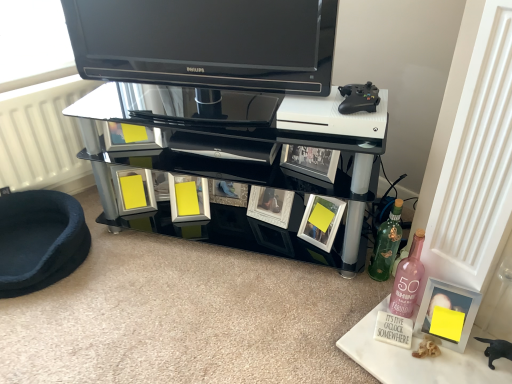
Identify the location of free space to the left of pink glass bottle at lower right, which appears as the first bottle when viewed from the front. This screenshot has width=512, height=384. (351, 317).